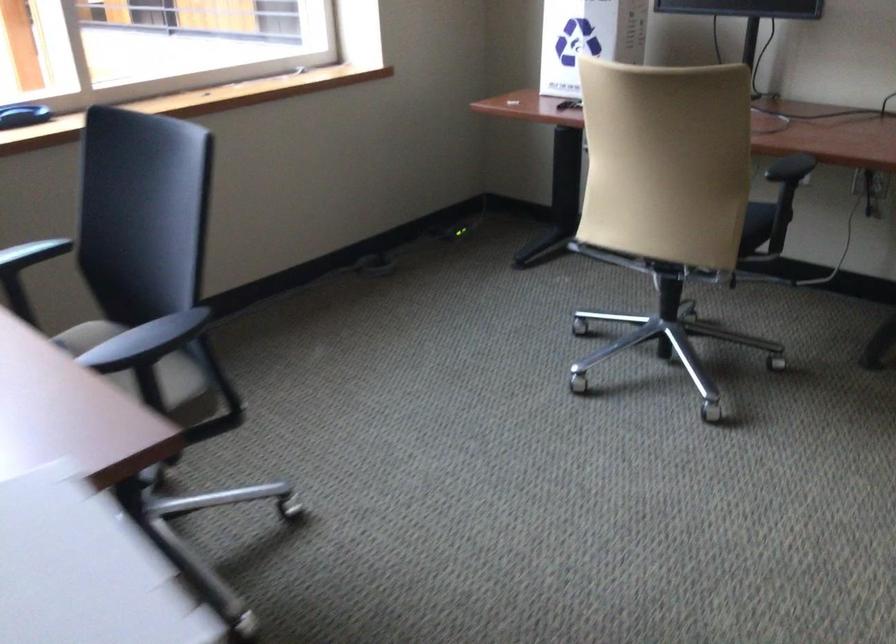
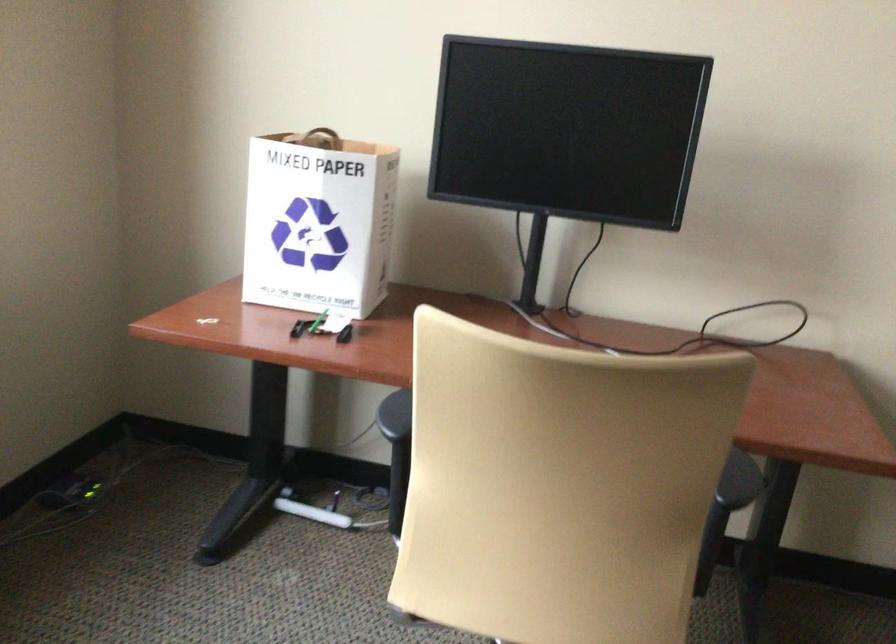
Question: Which direction would the cameraman need to move to produce the second image? Reply with the corresponding letter.

Choices:
 (A) Left
 (B) Right
 (C) Forward
 (D) Backward

Answer: (C)